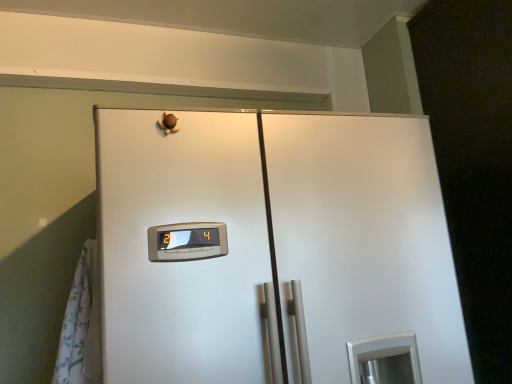
Question: Could you tell me if satin white refrigerator at center is facing white floral fabric curtain at left?

Choices:
 (A) yes
 (B) no

Answer: (B)

Question: Is satin white refrigerator at center thinner than white floral fabric curtain at left?

Choices:
 (A) yes
 (B) no

Answer: (B)

Question: Can we say satin white refrigerator at center lies outside white floral fabric curtain at left?

Choices:
 (A) yes
 (B) no

Answer: (A)

Question: Does satin white refrigerator at center have a greater height compared to white floral fabric curtain at left?

Choices:
 (A) yes
 (B) no

Answer: (A)

Question: Is satin white refrigerator at center looking in the opposite direction of white floral fabric curtain at left?

Choices:
 (A) yes
 (B) no

Answer: (B)

Question: Is white floral fabric curtain at left a part of satin white refrigerator at center?

Choices:
 (A) no
 (B) yes

Answer: (A)

Question: Is white floral fabric curtain at left to the right of satin white refrigerator at center from the viewer's perspective?

Choices:
 (A) yes
 (B) no

Answer: (B)

Question: Considering the relative sizes of white floral fabric curtain at left and satin white refrigerator at center in the image provided, is white floral fabric curtain at left smaller than satin white refrigerator at center?

Choices:
 (A) no
 (B) yes

Answer: (B)

Question: Can you confirm if white floral fabric curtain at left is taller than satin white refrigerator at center?

Choices:
 (A) yes
 (B) no

Answer: (B)

Question: Is white floral fabric curtain at left touching satin white refrigerator at center?

Choices:
 (A) no
 (B) yes

Answer: (A)

Question: Is white floral fabric curtain at left behind satin white refrigerator at center?

Choices:
 (A) yes
 (B) no

Answer: (A)

Question: Is white floral fabric curtain at left bigger than satin white refrigerator at center?

Choices:
 (A) no
 (B) yes

Answer: (A)

Question: Do you think white floral fabric curtain at left is within satin white refrigerator at center, or outside of it?

Choices:
 (A) inside
 (B) outside

Answer: (B)